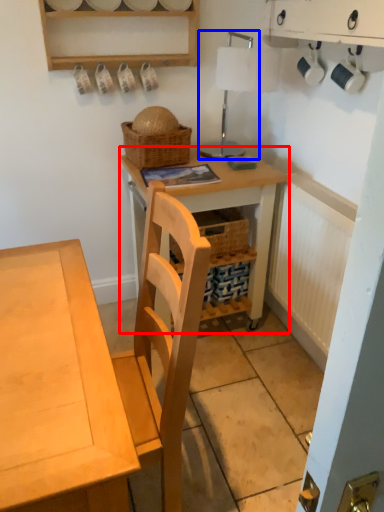
Question: Which of the following is the farthest to the observer, table (highlighted by a red box) or table lamp (highlighted by a blue box)?

Choices:
 (A) table
 (B) table lamp

Answer: (A)